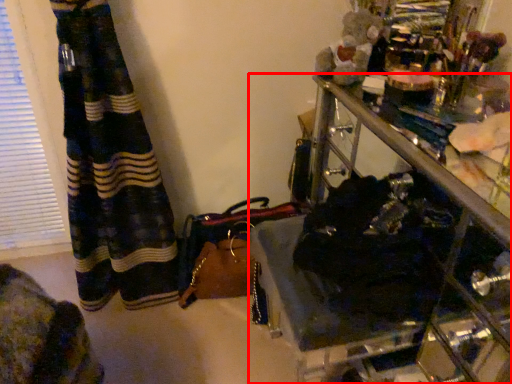
Question: In this image, where is furniture (annotated by the red box) located relative to handbag?

Choices:
 (A) right
 (B) left

Answer: (A)